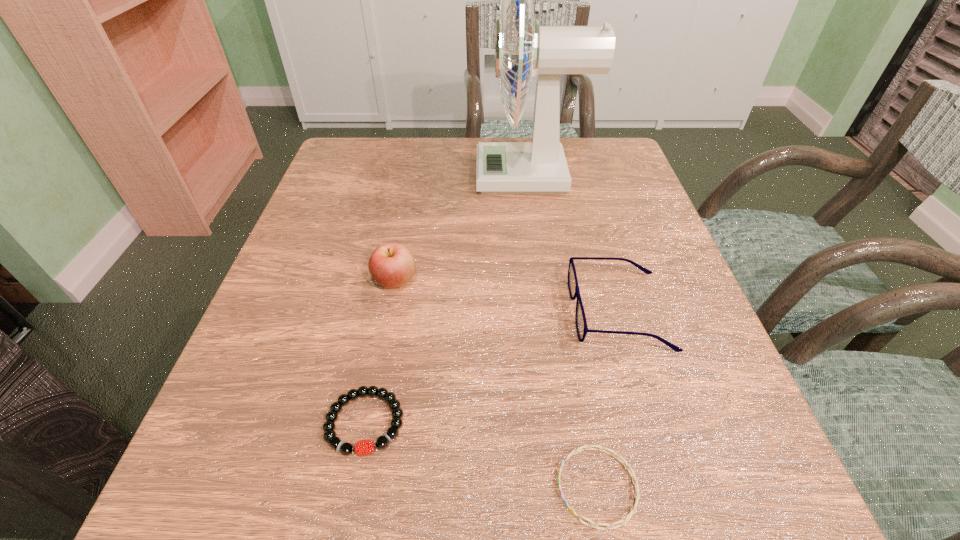
Find the location of `vacant point located between the tallest object and the third tallest object`. vacant point located between the tallest object and the third tallest object is located at coordinates (574, 244).

This screenshot has height=540, width=960. Find the location of `vacant space in between the fan and the shortest object`. vacant space in between the fan and the shortest object is located at coordinates (564, 332).

Find the location of `object that is the fourth closest to the right bracelet`. object that is the fourth closest to the right bracelet is located at coordinates (538, 167).

This screenshot has width=960, height=540. I want to click on object that can be found as the third closest to the spectacles, so click(364, 447).